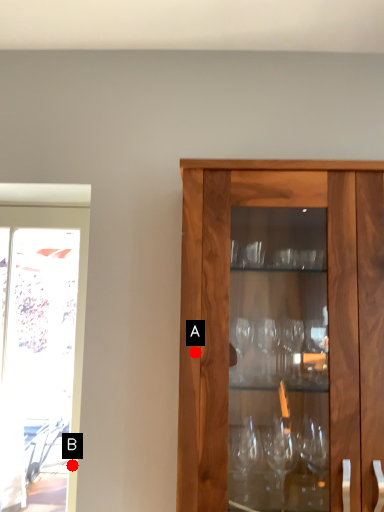
Question: Two points are circled on the image, labeled by A and B beside each circle. Among these points, which one is farthest from the camera?

Choices:
 (A) A is further
 (B) B is further

Answer: (B)